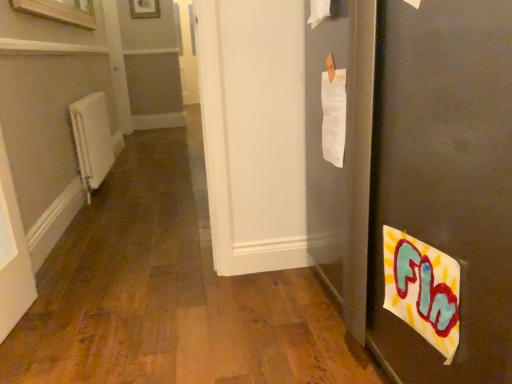
Question: From a real-world perspective, is matte black door at right positioned above or below wooden frame at upper center?

Choices:
 (A) below
 (B) above

Answer: (A)

Question: Looking at their shapes, would you say matte black door at right is wider or thinner than wooden frame at upper center?

Choices:
 (A) wide
 (B) thin

Answer: (A)

Question: Which object is the closest to the white matte radiator at left?

Choices:
 (A) wooden frame at upper center
 (B) matte black door at right

Answer: (B)

Question: Based on their relative distances, which object is farther from the matte black door at right?

Choices:
 (A) white matte radiator at left
 (B) wooden frame at upper center

Answer: (B)